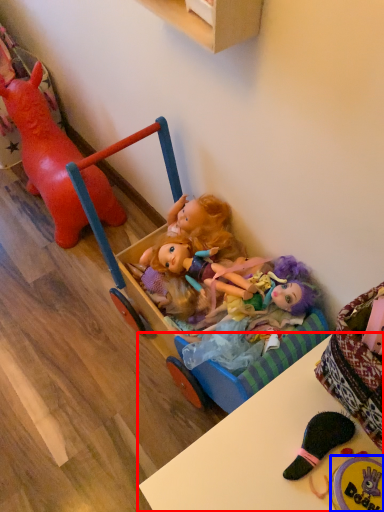
Question: Which of the following is the closest to the observer, table (highlighted by a red box) or toy (highlighted by a blue box)?

Choices:
 (A) table
 (B) toy

Answer: (A)